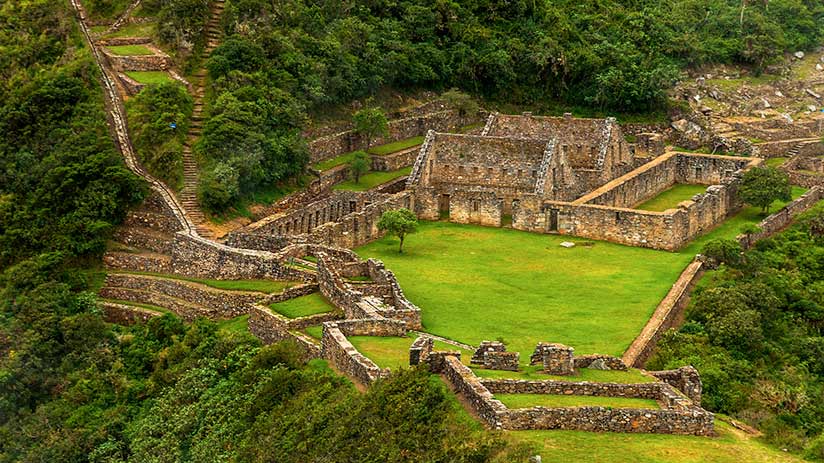
You are a GUI agent. You are given a task and a screenshot of the screen. Output one action in this format:
    pyautogui.click(x=<x>, y=<y>)
    Task: Click on the stairs
    
    Given the screenshot: What is the action you would take?
    [200, 112]